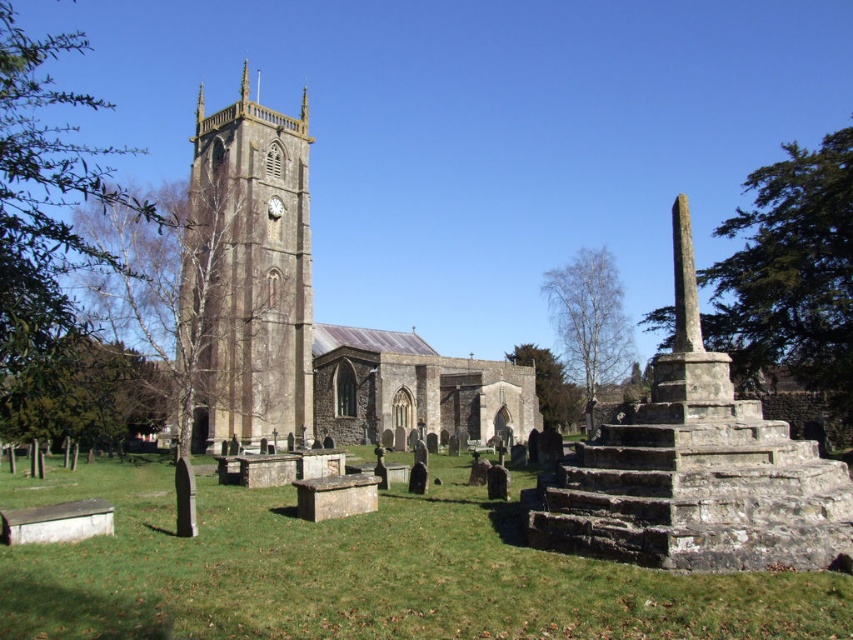
Can you confirm if stone church at center is positioned above stone clock tower at left?

Actually, stone church at center is below stone clock tower at left.

Image resolution: width=853 pixels, height=640 pixels. What do you see at coordinates (302, 312) in the screenshot?
I see `stone church at center` at bounding box center [302, 312].

Measure the distance between point [363,328] and camera.

The distance of point [363,328] from camera is 126.16 meters.

What are the coordinates of `stone church at center` in the screenshot? It's located at (302, 312).

Which of these two, green grassy at lower center or stone clock tower at left, stands taller?

stone clock tower at left

Between point (526, 554) and point (239, 419), which one is positioned behind?

The point (239, 419) is behind.

Which is behind, point (223, 513) or point (198, 312)?

The point (198, 312) is more distant.

Where is `green grassy at lower center`? This screenshot has height=640, width=853. green grassy at lower center is located at coordinates (361, 572).

Who is more forward, (134, 634) or (328, 372)?

Point (134, 634) is more forward.

Between point (16, 621) and point (251, 376), which one is positioned behind?

The point (251, 376) is more distant.

Is point (183, 563) less distant than point (238, 300)?

Yes, point (183, 563) is in front of point (238, 300).

Locate an element on the screen. green grassy at lower center is located at coordinates (361, 572).